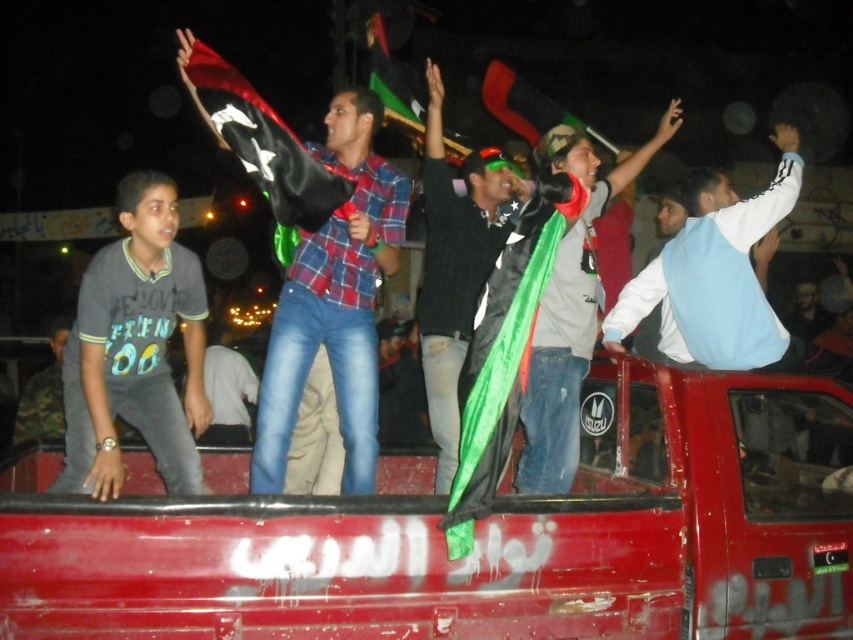
Does plaid shirt at center appear over green fabric flag at center?

No, plaid shirt at center is not above green fabric flag at center.

Does point (335, 301) come behind point (422, 336)?

No, (335, 301) is in front of (422, 336).

You are a GUI agent. You are given a task and a screenshot of the screen. Output one action in this format:
    pyautogui.click(x=<x>, y=<y>)
    Task: Click on the plaid shirt at center
    Image resolution: width=853 pixels, height=640 pixels.
    Given the screenshot: What is the action you would take?
    coord(334,304)

Based on the photo, who is taller, gray cotton shirt at left or green fabric flag at center?

green fabric flag at center

In the scene shown: Does gray cotton shirt at left have a larger size compared to green fabric flag at center?

Correct, gray cotton shirt at left is larger in size than green fabric flag at center.

At what (x,y) coordinates should I click in order to perform the action: click on gray cotton shirt at left. Please return your answer as a coordinate pair (x, y). Looking at the image, I should click on (135, 348).

Can you confirm if gray cotton shirt at left is positioned below plaid shirt at center?

Indeed, gray cotton shirt at left is positioned under plaid shirt at center.

Between point (97, 464) and point (273, 333), which one is positioned behind?

The point (273, 333) is more distant.

What do you see at coordinates (135, 348) in the screenshot?
I see `gray cotton shirt at left` at bounding box center [135, 348].

I want to click on gray cotton shirt at left, so click(x=135, y=348).